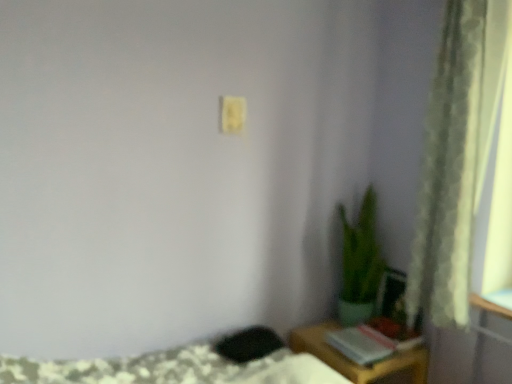
The image size is (512, 384). I want to click on vacant location below hardcover book at lower right (from a real-world perspective), so click(359, 353).